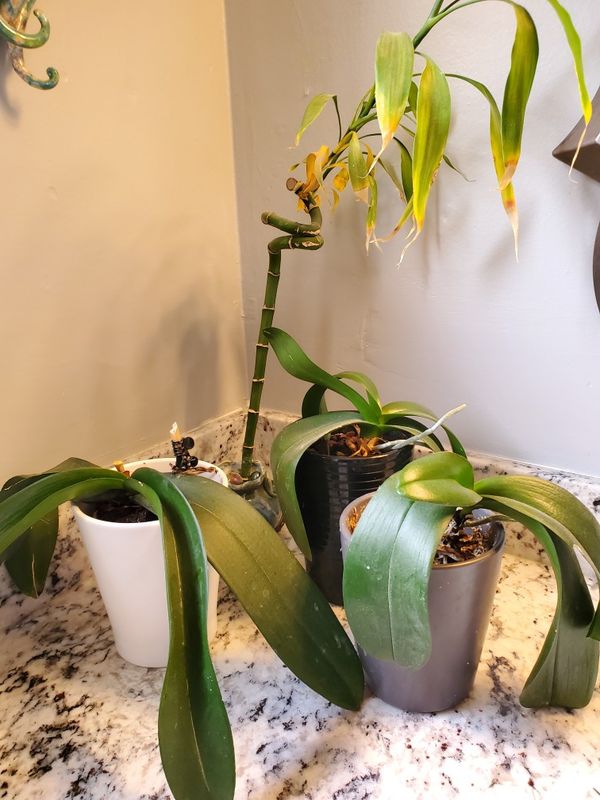
Find the location of a particular element. This screenshot has height=800, width=600. white pot is located at coordinates (124, 576).